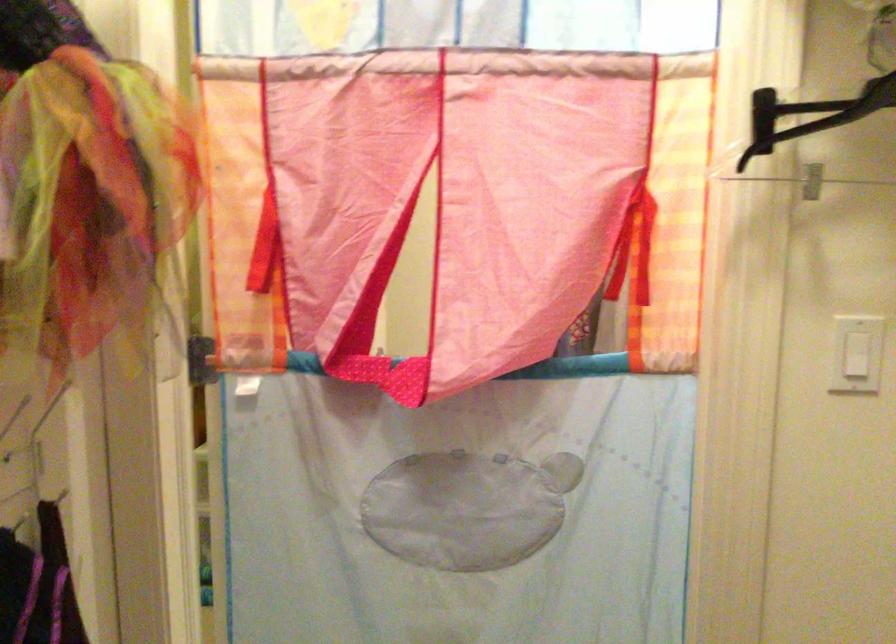
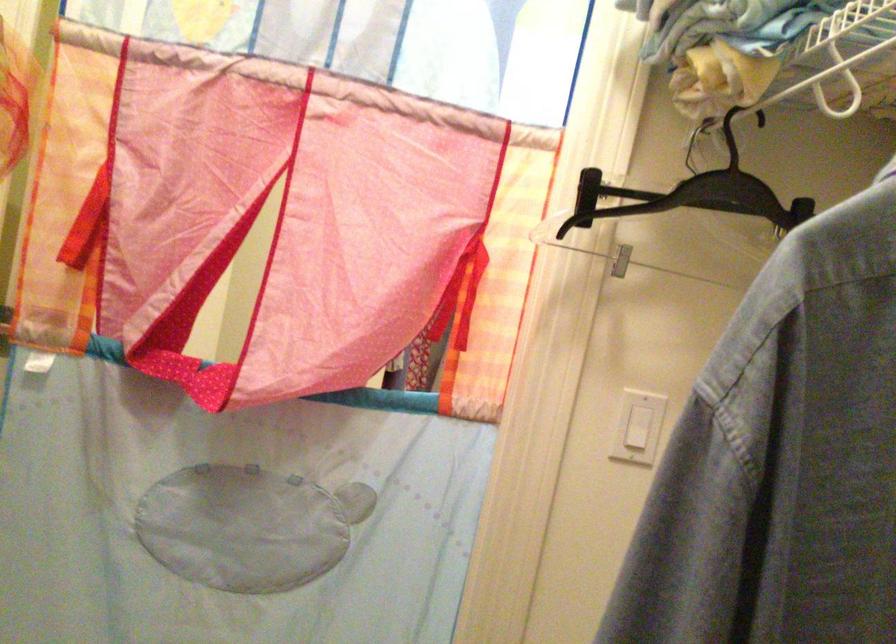
Locate, in the second image, the point that corresponds to (385,377) in the first image.

(188, 375)